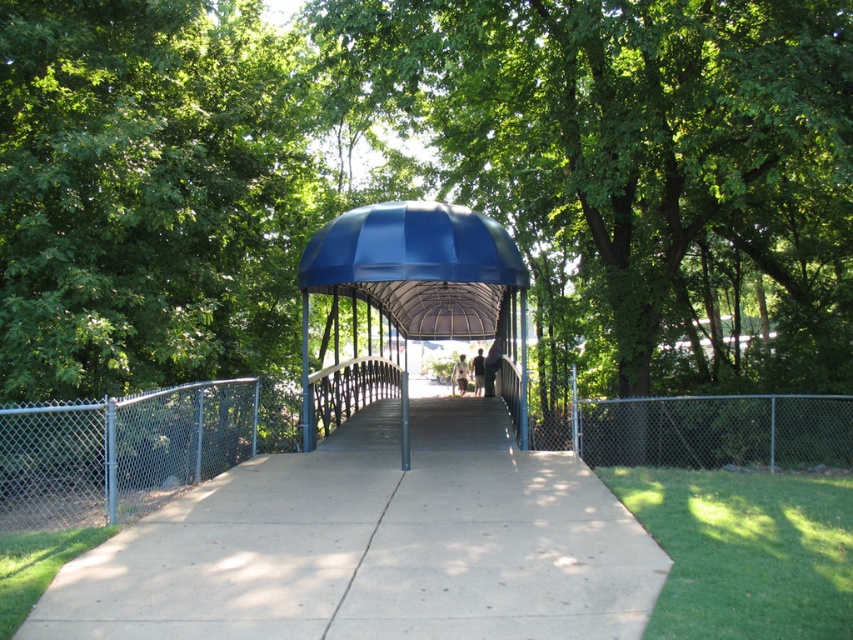
Question: Does chain link fence at left have a larger size compared to light brown fabric shirt at center?

Choices:
 (A) no
 (B) yes

Answer: (B)

Question: Based on their relative distances, which object is farther from the concrete at center?

Choices:
 (A) chain link fence at left
 (B) light brown fabric shirt at center
 (C) blue metal/glass gazebo at center

Answer: (B)

Question: Which object is farther from the camera taking this photo?

Choices:
 (A) concrete at center
 (B) light brown fabric jacket at center
 (C) dark blue fabric person at center
 (D) blue metal/glass gazebo at center

Answer: (B)

Question: Is chain link fence at left further to camera compared to dark blue fabric person at center?

Choices:
 (A) yes
 (B) no

Answer: (B)

Question: Considering the real-world distances, which object is farthest from the dark blue fabric person at center?

Choices:
 (A) chain link fence at left
 (B) blue metal/glass gazebo at center
 (C) concrete at center
 (D) chain link fence at right

Answer: (A)

Question: Can you confirm if blue metal/glass gazebo at center is wider than chain link fence at left?

Choices:
 (A) yes
 (B) no

Answer: (A)